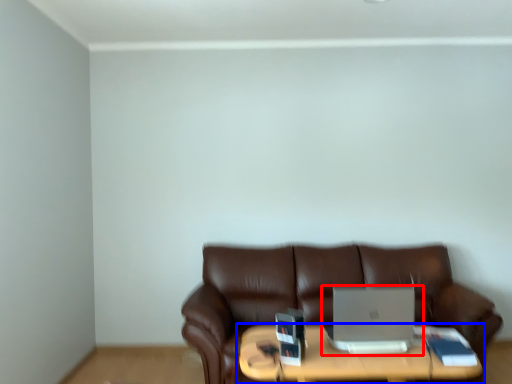
Question: Which of the following is the farthest to the observer, laptop (highlighted by a red box) or table (highlighted by a blue box)?

Choices:
 (A) laptop
 (B) table

Answer: (A)